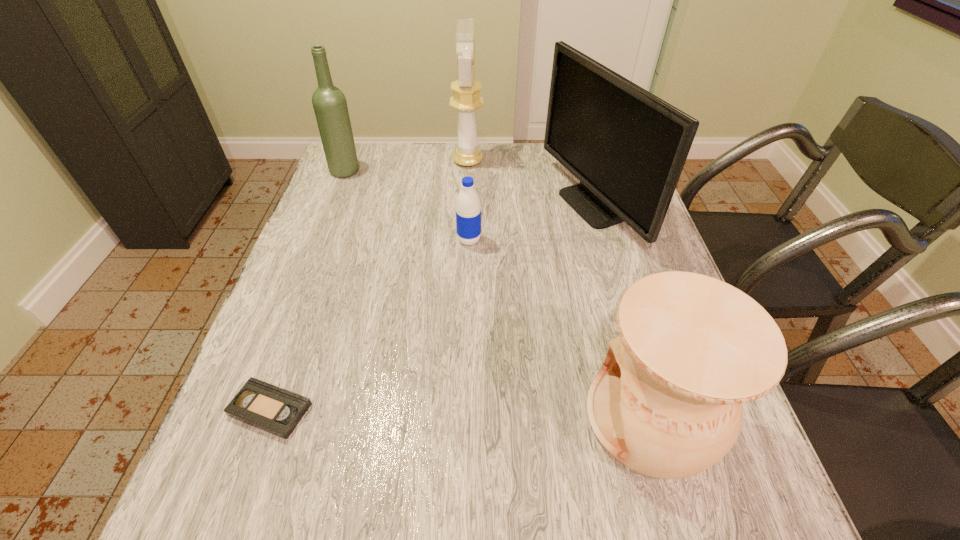
Locate an element on the screen. The image size is (960, 540). award is located at coordinates (466, 98).

Locate an element on the screen. computer monitor is located at coordinates (627, 147).

At what (x,y) coordinates should I click in order to perform the action: click on wine bottle. Please return your answer as a coordinate pair (x, y). The width and height of the screenshot is (960, 540). Looking at the image, I should click on (330, 106).

Identify the location of the third shortest object. (667, 403).

Identify the location of water bottle. (468, 207).

You are a GUI agent. You are given a task and a screenshot of the screen. Output one action in this format:
    pyautogui.click(x=<x>, y=<y>)
    Task: Click on the shortest object
    
    Given the screenshot: What is the action you would take?
    pyautogui.click(x=272, y=409)

Locate an element on the screen. vacant point located 0.300m on the front-facing side of the award is located at coordinates (578, 161).

Where is `vacant space located on the front-facing side of the computer monitor`? This screenshot has height=540, width=960. vacant space located on the front-facing side of the computer monitor is located at coordinates (481, 206).

This screenshot has width=960, height=540. I want to click on free location located 0.100m on the front-facing side of the computer monitor, so click(x=514, y=206).

Where is `free space located on the front-facing side of the computer monitor`? This screenshot has height=540, width=960. free space located on the front-facing side of the computer monitor is located at coordinates (406, 206).